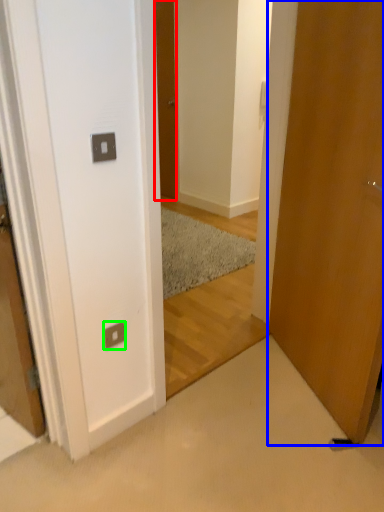
Question: Which object is positioned closest to door (highlighted by a red box)? Select from door (highlighted by a blue box) and electric outlet (highlighted by a green box).

Choices:
 (A) door
 (B) electric outlet

Answer: (A)